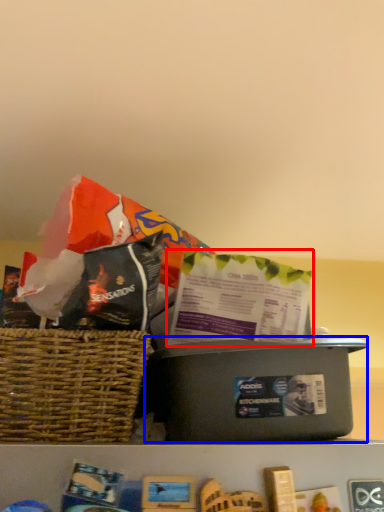
Question: Which object appears closest to the camera in this image, gift bag (highlighted by a red box) or box (highlighted by a blue box)?

Choices:
 (A) gift bag
 (B) box

Answer: (B)